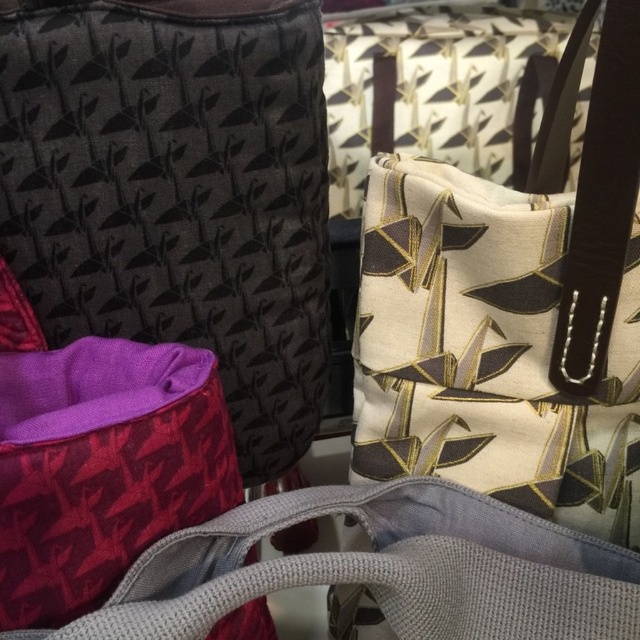
Question: Which object is farther from the camera taking this photo?

Choices:
 (A) matte purple fabric bag at lower left
 (B) matte black fabric bag at center

Answer: (A)

Question: Is purple fabric bag at lower left to the right of matte purple fabric bag at lower left from the viewer's perspective?

Choices:
 (A) yes
 (B) no

Answer: (B)

Question: Does purple fabric bag at lower left appear over matte purple fabric bag at lower left?

Choices:
 (A) no
 (B) yes

Answer: (B)

Question: Which of the following is the farthest from the observer?

Choices:
 (A) (598, 122)
 (B) (77, 259)
 (C) (420, 502)

Answer: (C)

Question: Which object is the farthest from the matte purple fabric bag at lower left?

Choices:
 (A) matte black fabric bag at center
 (B) purple fabric bag at lower left

Answer: (B)

Question: Does purple fabric bag at lower left have a lesser width compared to matte purple fabric bag at lower left?

Choices:
 (A) no
 (B) yes

Answer: (B)